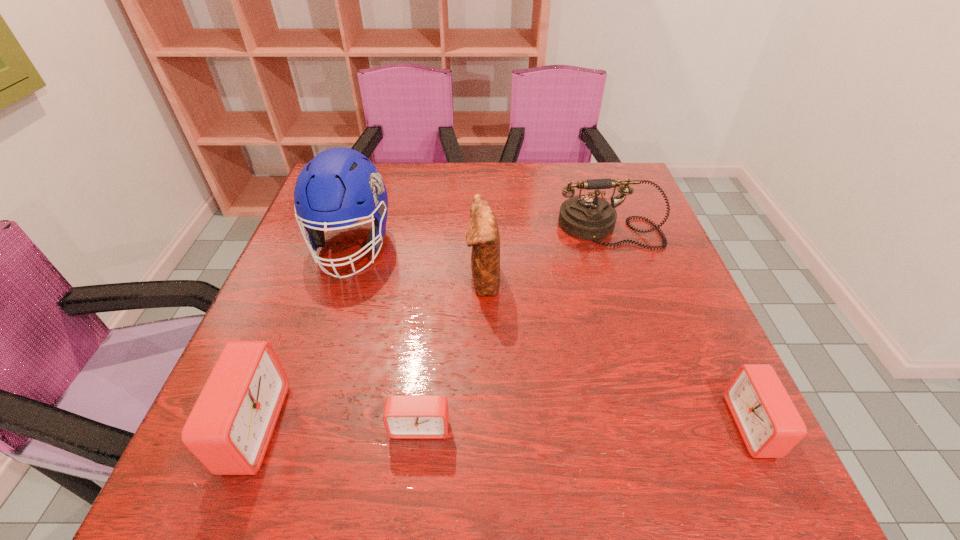
Locate an element on the screen. The width and height of the screenshot is (960, 540). football helmet that is positioned at the left edge is located at coordinates (340, 186).

Identify the location of alarm clock present at the right edge. (770, 425).

Identify the location of telephone that is at the right edge. (587, 217).

You are a GUI agent. You are given a task and a screenshot of the screen. Output one action in this format:
    pyautogui.click(x=<x>, y=<y>)
    Task: Click on the object present at the near left corner
    
    Given the screenshot: What is the action you would take?
    pyautogui.click(x=230, y=426)

Image resolution: width=960 pixels, height=540 pixels. Find the location of `object located at the far right corner`. object located at the far right corner is located at coordinates (587, 217).

Where is `object that is at the near right corner`? This screenshot has height=540, width=960. object that is at the near right corner is located at coordinates (770, 425).

In the image, there is a desktop. At what (x,y) coordinates should I click in order to perform the action: click on vacant space at the far edge. Please return your answer as a coordinate pair (x, y). This screenshot has height=540, width=960. Looking at the image, I should click on (561, 200).

The width and height of the screenshot is (960, 540). I want to click on vacant space at the near edge of the desktop, so click(469, 394).

Identify the location of vacant region at the right edge of the desktop. (629, 251).

In the image, there is a desktop. In order to click on free space at the far right corner in this screenshot , I will do `click(606, 172)`.